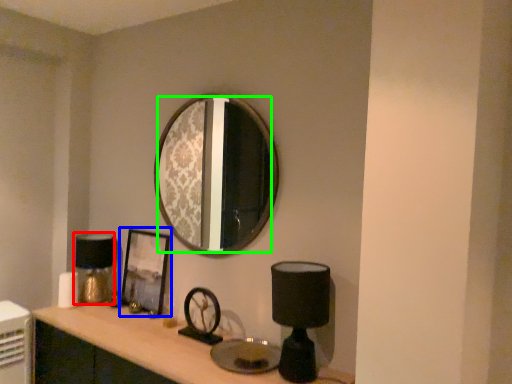
Question: Based on their relative distances, which object is farther from table lamp (highlighted by a red box)? Choose from picture frame (highlighted by a blue box) and mirror (highlighted by a green box).

Choices:
 (A) picture frame
 (B) mirror

Answer: (B)